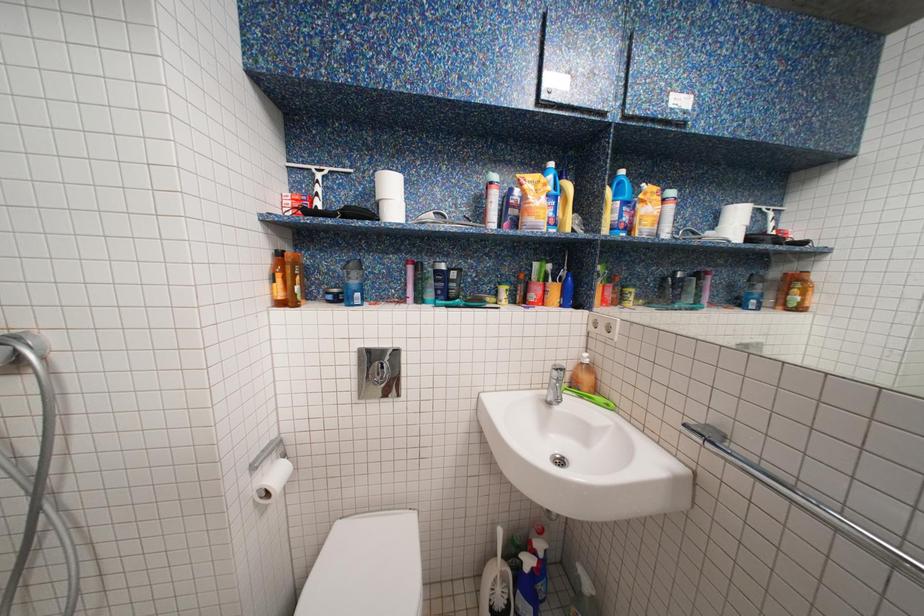
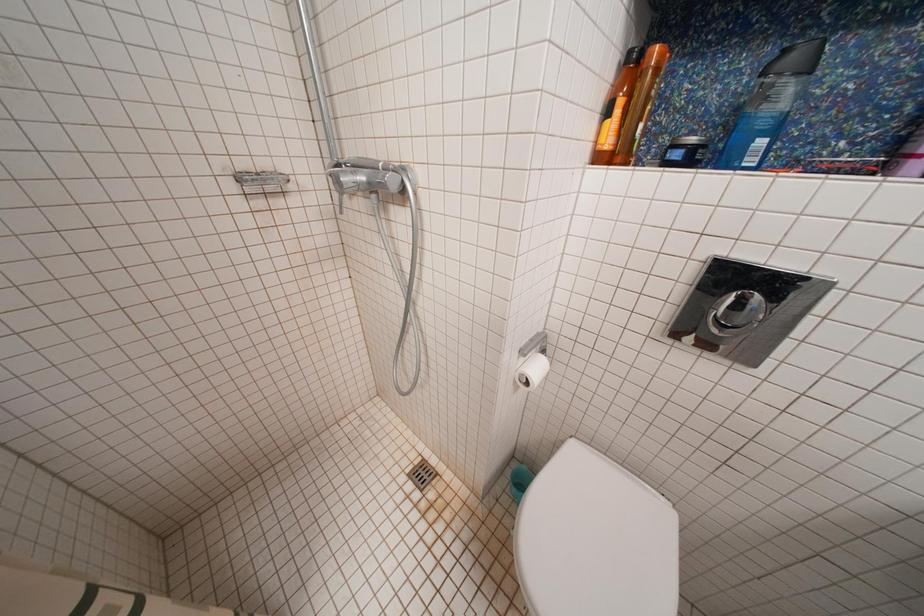
How did the camera likely rotate?

The rotation direction of the camera is left-down.